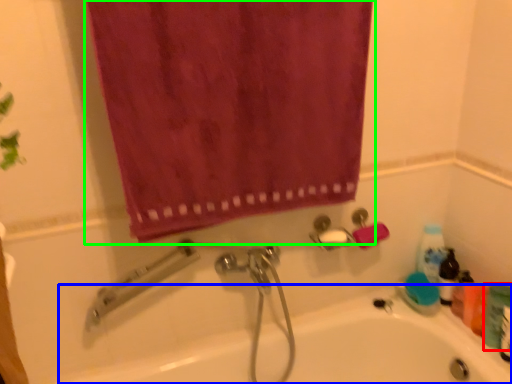
Question: Estimate the real-world distances between objects in this image. Which object is closer to toiletry (highlighted by a red box), bath (highlighted by a blue box) or curtain (highlighted by a green box)?

Choices:
 (A) bath
 (B) curtain

Answer: (A)